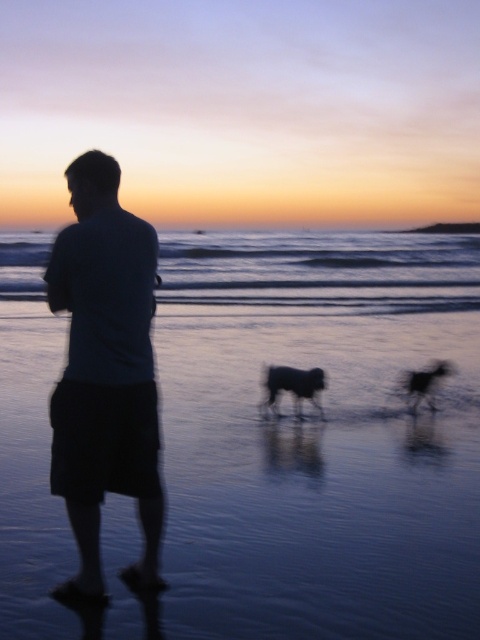
Question: Is black furry dog at center positioned in front of silky black dog at center?

Choices:
 (A) yes
 (B) no

Answer: (A)

Question: Considering the real-world distances, which object is farthest from the dark blue shirt at center?

Choices:
 (A) smooth sand at lower center
 (B) silky black dog at center

Answer: (A)

Question: Is dark blue shirt at center positioned behind silky black dog at center?

Choices:
 (A) no
 (B) yes

Answer: (A)

Question: Which point is closer to the camera taking this photo?

Choices:
 (A) (424, 388)
 (B) (193, 273)
 (C) (289, 387)

Answer: (C)

Question: Which object appears farthest from the camera in this image?

Choices:
 (A) silky black dog at center
 (B) smooth sand at lower center
 (C) black furry dog at center

Answer: (B)

Question: Where is dark blue shirt at center located in relation to black furry dog at center in the image?

Choices:
 (A) left
 (B) right

Answer: (A)